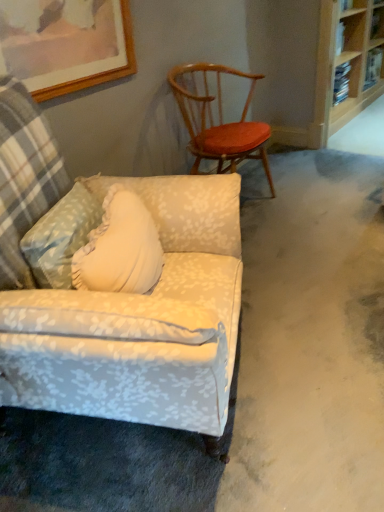
At what (x,y) coordinates should I click in order to perform the action: click on unoccupied region to the right of wooden spindles chair at upper right, which is counted as the 2th chair, starting from the front. Please return your answer as a coordinate pair (x, y). Looking at the image, I should click on (301, 201).